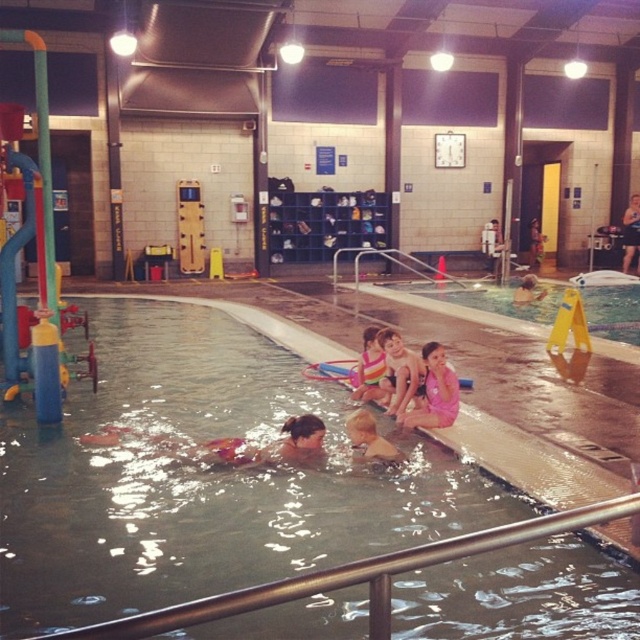
Question: Observing the image, what is the correct spatial positioning of pink fabric swimsuit at lower right in reference to light brown skin at center?

Choices:
 (A) right
 (B) left

Answer: (A)

Question: Considering the relative positions of striped fabric swimsuit at center and smooth blue swimmer at upper right in the image provided, where is striped fabric swimsuit at center located with respect to smooth blue swimmer at upper right?

Choices:
 (A) left
 (B) right

Answer: (A)

Question: Which point appears farthest from the camera in this image?

Choices:
 (A) (442, 369)
 (B) (376, 332)
 (C) (637, 195)
 (D) (392, 342)

Answer: (C)

Question: Is pink fabric swimsuit at lower right positioned before pink fabric swimsuit at center?

Choices:
 (A) no
 (B) yes

Answer: (B)

Question: Which point is farther from the camera taking this photo?

Choices:
 (A) (365, 328)
 (B) (454, 394)

Answer: (A)

Question: Which of the following is the farthest from the observer?

Choices:
 (A) striped fabric swimsuit at center
 (B) clear plastic pool at center
 (C) pink fabric swimsuit at lower right
 (D) smooth blue swimmer at upper right

Answer: (D)